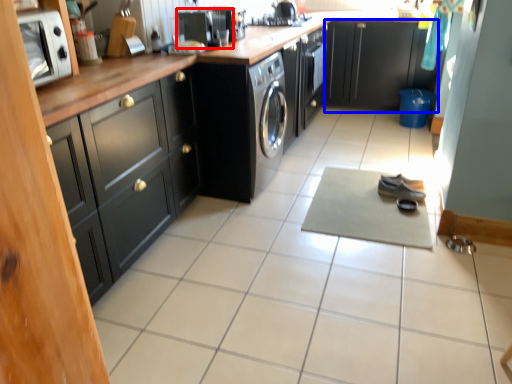
Question: Among these objects, which one is farthest to the camera, appliance (highlighted by a red box) or cabinetry (highlighted by a blue box)?

Choices:
 (A) appliance
 (B) cabinetry

Answer: (B)